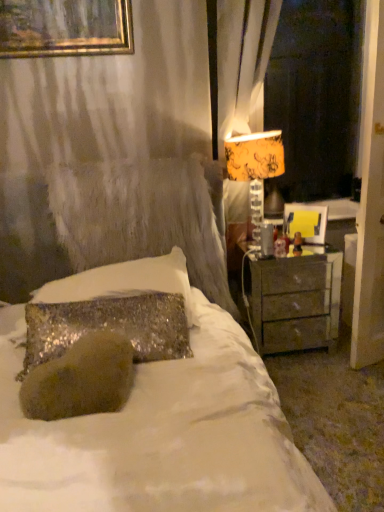
Question: Would you say yellow fabric lampshade at upper right is to the left or to the right of matte yellow lampshade at right in the picture?

Choices:
 (A) left
 (B) right

Answer: (A)

Question: From the image's perspective, is yellow fabric lampshade at upper right above or below matte yellow lampshade at right?

Choices:
 (A) below
 (B) above

Answer: (A)

Question: Which object is positioned closest to the yellow fabric lampshade at upper right?

Choices:
 (A) matte gray nightstand at right
 (B) matte yellow lampshade at right
 (C) sparkly silver pillow at center

Answer: (C)

Question: Which of these objects is positioned farthest from the matte yellow lampshade at right?

Choices:
 (A) yellow fabric lampshade at upper right
 (B) matte gray nightstand at right
 (C) sparkly silver pillow at center

Answer: (C)